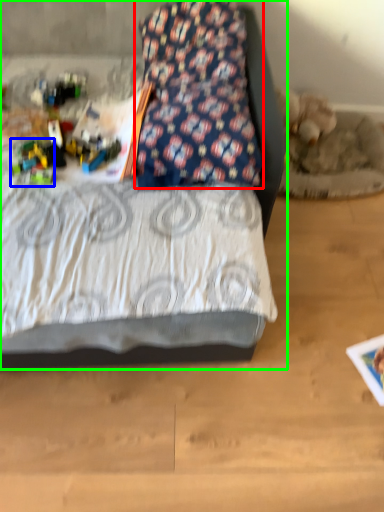
Question: Estimate the real-world distances between objects in this image. Which object is closer to pillow (highlighted by a red box), toy (highlighted by a blue box) or bed (highlighted by a green box)?

Choices:
 (A) toy
 (B) bed

Answer: (A)